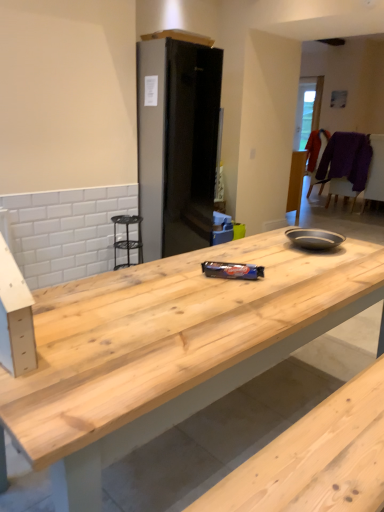
Question: Is purple fabric chair at upper right, which is the second chair from front to back, inside or outside of black matte refrigerator at center?

Choices:
 (A) outside
 (B) inside

Answer: (A)

Question: Considering the relative positions of purple fabric chair at upper right, which is the first chair from back to front, and black matte refrigerator at center in the image provided, is purple fabric chair at upper right, which is the first chair from back to front, to the left or to the right of black matte refrigerator at center?

Choices:
 (A) left
 (B) right

Answer: (B)

Question: Which is nearer to the natural wood countertop at center?

Choices:
 (A) purple woolen sweater at right, the 2th chair when ordered from back to front
 (B) purple fabric chair at upper right, which is the second chair from front to back
 (C) black matte refrigerator at center

Answer: (C)

Question: Which of these objects is positioned closest to the natural wood countertop at center?

Choices:
 (A) black matte refrigerator at center
 (B) purple fabric chair at upper right, which is the second chair from front to back
 (C) purple woolen sweater at right, the 2th chair when ordered from back to front

Answer: (A)